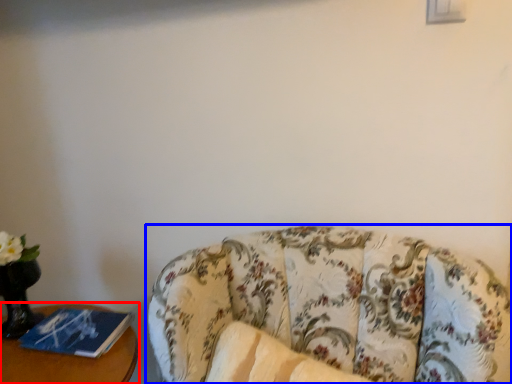
Question: Among these objects, which one is farthest to the camera, furniture (highlighted by a red box) or studio couch (highlighted by a blue box)?

Choices:
 (A) furniture
 (B) studio couch

Answer: (A)